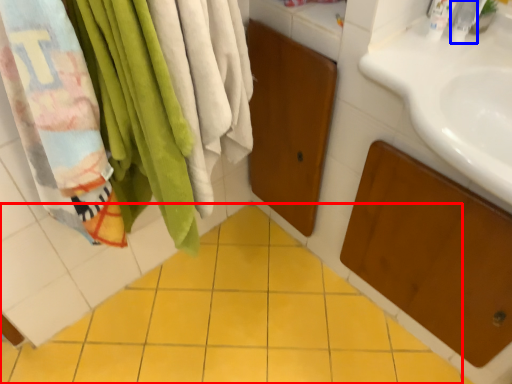
Question: Which point is further to the camera, ceramic tile (highlighted by a red box) or toiletry (highlighted by a blue box)?

Choices:
 (A) ceramic tile
 (B) toiletry

Answer: (B)